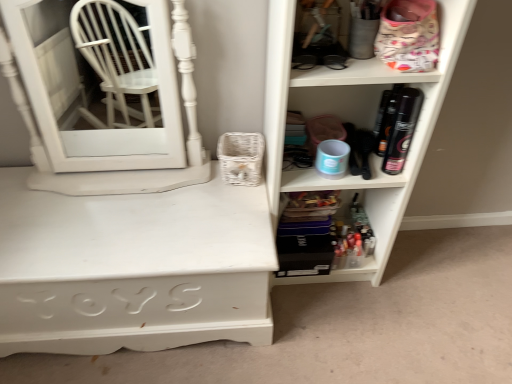
Find the location of a particular element. The image size is (512, 384). vacant area that is in front of matte white shelf at right, placed as the 1th shelf when sorted from top to bottom is located at coordinates (340, 332).